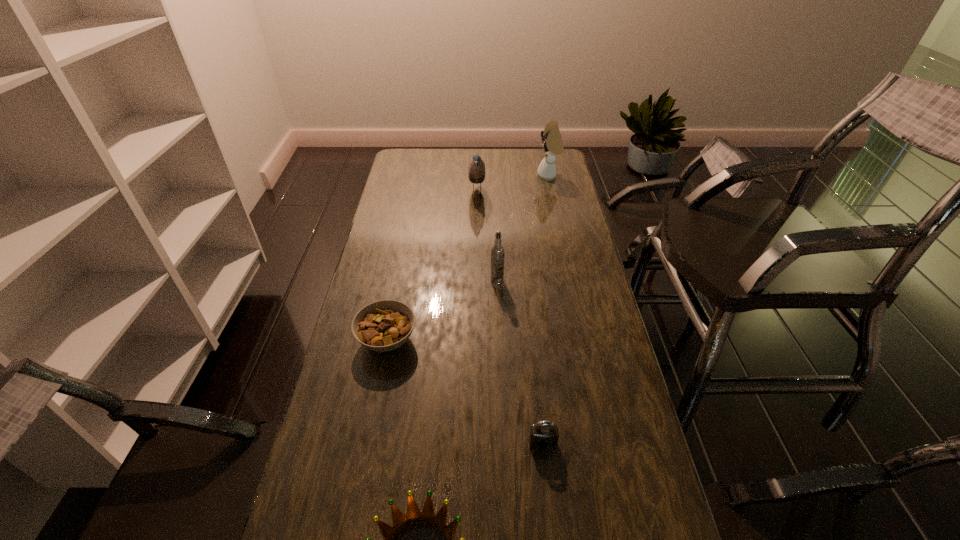
This screenshot has height=540, width=960. I want to click on free point at the far edge, so click(511, 159).

The image size is (960, 540). In order to click on vacant area at the left edge in this screenshot , I will do point(366,283).

Image resolution: width=960 pixels, height=540 pixels. What are the coordinates of `vacant space at the right edge` in the screenshot? It's located at (553, 264).

At what (x,y) coordinates should I click in order to perform the action: click on vacant point located between the shortest object and the tallest object. Please return your answer as a coordinate pair (x, y). This screenshot has width=960, height=540. Looking at the image, I should click on (468, 258).

This screenshot has height=540, width=960. What are the coordinates of `free space between the third object from right to left and the shortest object` in the screenshot? It's located at (442, 310).

This screenshot has height=540, width=960. What are the coordinates of `empty space that is in between the bird and the padlock` in the screenshot? It's located at (510, 319).

Find the location of a particular element. vacant space in between the doll and the fifth farthest object is located at coordinates (546, 309).

The image size is (960, 540). Identify the location of vacant area between the bird and the padlock. (510, 319).

Identify the location of the fifth closest object relative to the bird. (414, 516).

This screenshot has width=960, height=540. In order to click on object that can be found as the closest to the nearest object in this screenshot , I will do `click(544, 435)`.